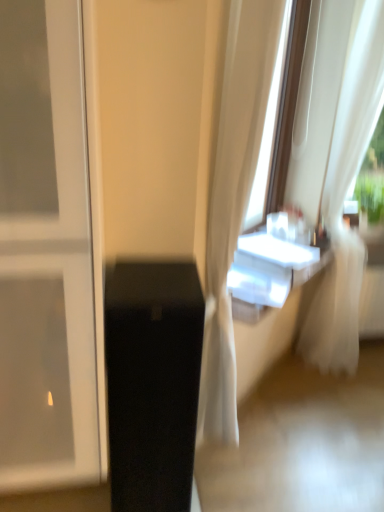
Question: From the image's perspective, is white sheer curtain at right on black glossy speaker at lower left?

Choices:
 (A) yes
 (B) no

Answer: (A)

Question: Is white sheer curtain at right positioned in front of black glossy speaker at lower left?

Choices:
 (A) yes
 (B) no

Answer: (B)

Question: From a real-world perspective, is white sheer curtain at right below black glossy speaker at lower left?

Choices:
 (A) no
 (B) yes

Answer: (A)

Question: Is white sheer curtain at right smaller than black glossy speaker at lower left?

Choices:
 (A) no
 (B) yes

Answer: (A)

Question: Is white sheer curtain at right positioned with its back to black glossy speaker at lower left?

Choices:
 (A) yes
 (B) no

Answer: (B)

Question: From a real-world perspective, is white sheer curtain at right over black glossy speaker at lower left?

Choices:
 (A) yes
 (B) no

Answer: (A)

Question: Is the position of black glossy speaker at lower left more distant than that of white sheer curtain at right?

Choices:
 (A) no
 (B) yes

Answer: (A)

Question: Does black glossy speaker at lower left have a greater width compared to white sheer curtain at right?

Choices:
 (A) yes
 (B) no

Answer: (A)

Question: From the image's perspective, would you say black glossy speaker at lower left is shown under white sheer curtain at right?

Choices:
 (A) yes
 (B) no

Answer: (A)

Question: From a real-world perspective, is black glossy speaker at lower left on top of white sheer curtain at right?

Choices:
 (A) yes
 (B) no

Answer: (B)

Question: Considering the relative sizes of black glossy speaker at lower left and white sheer curtain at right in the image provided, is black glossy speaker at lower left shorter than white sheer curtain at right?

Choices:
 (A) no
 (B) yes

Answer: (B)

Question: Could you tell me if black glossy speaker at lower left is turned towards white sheer curtain at right?

Choices:
 (A) yes
 (B) no

Answer: (B)

Question: From the image's perspective, relative to white sheer curtain at right, is black glossy speaker at lower left above or below?

Choices:
 (A) below
 (B) above

Answer: (A)